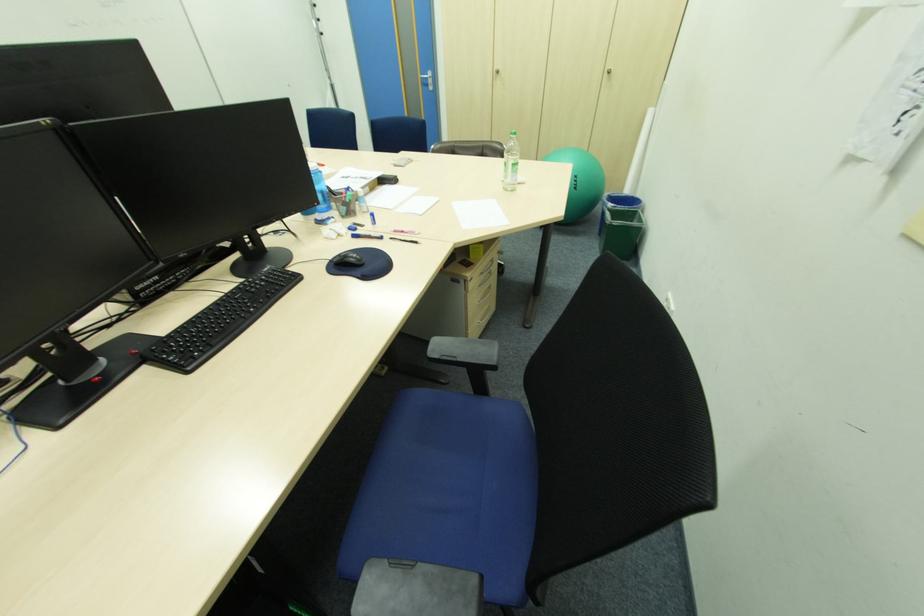
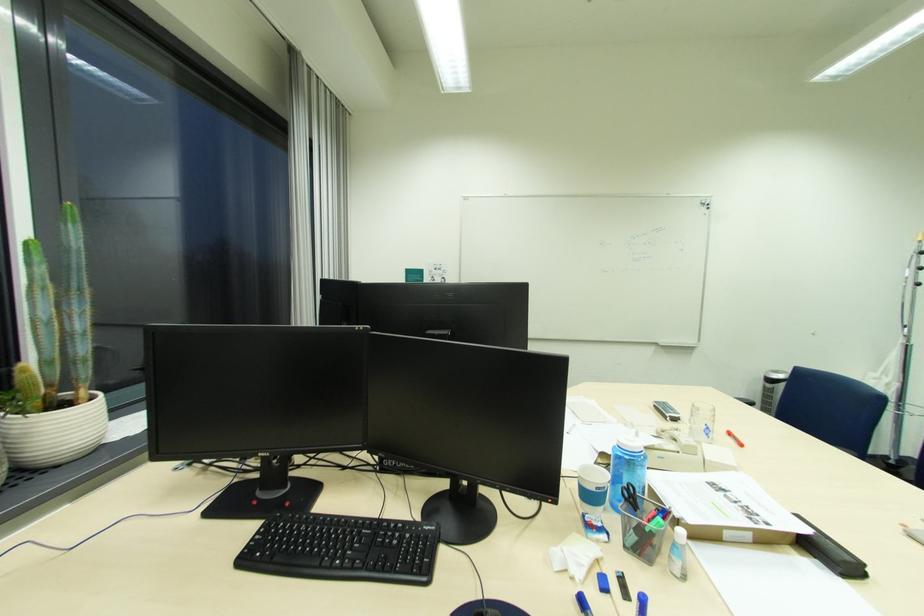
The point at (325, 215) is marked in the first image. Where is the corresponding point in the second image?

(616, 511)